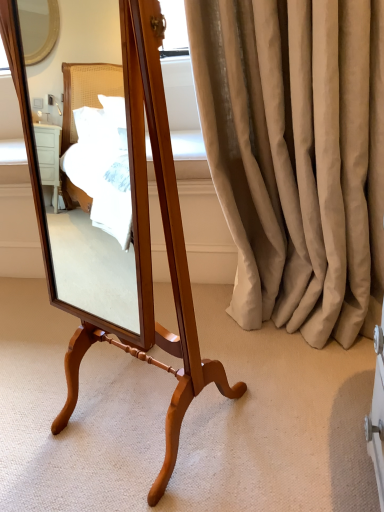
Describe the element at coordinates (297, 156) in the screenshot. I see `beige fabric curtain at right` at that location.

The height and width of the screenshot is (512, 384). Find the location of `beige fabric curtain at right`. beige fabric curtain at right is located at coordinates (297, 156).

You are a GUI agent. You are given a task and a screenshot of the screen. Output one action in this format:
    pyautogui.click(x=<x>, y=<y>)
    Task: Click on the beige fabric curtain at right
    The height and width of the screenshot is (512, 384).
    Given the screenshot: What is the action you would take?
    [297, 156]